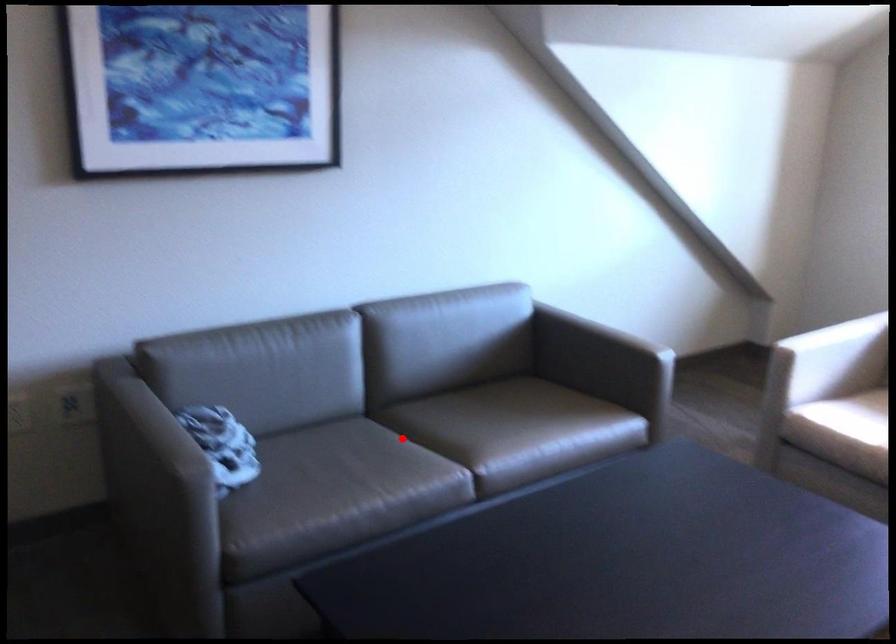
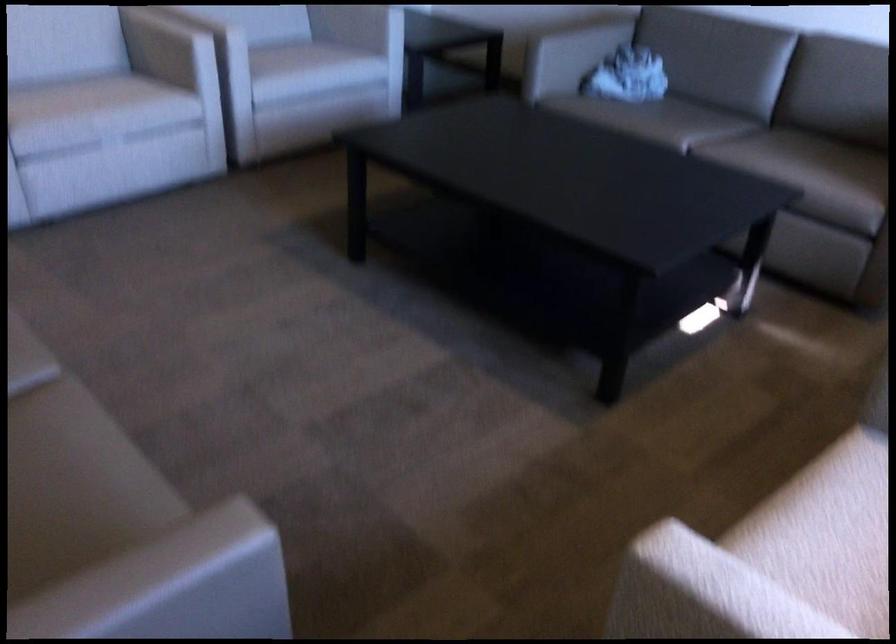
Locate, in the second image, the point that corresponds to the highlighted location in the first image.

(714, 127)